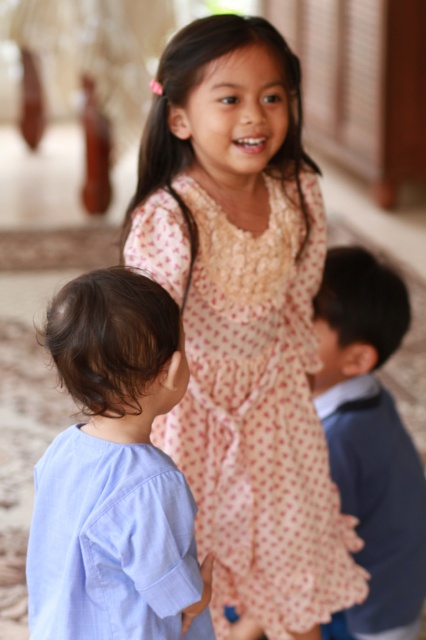
You are a photographer trying to capture a candid shot of the children. You notice the pink polka dot dress at center and the light blue cotton shirt at lower left. Which child should you focus on first if you want to photograph the one closer to the camera?

The pink polka dot dress at center is above the light blue cotton shirt at lower left, so the child wearing the pink polka dot dress at center is closer to the camera and should be focused on first.